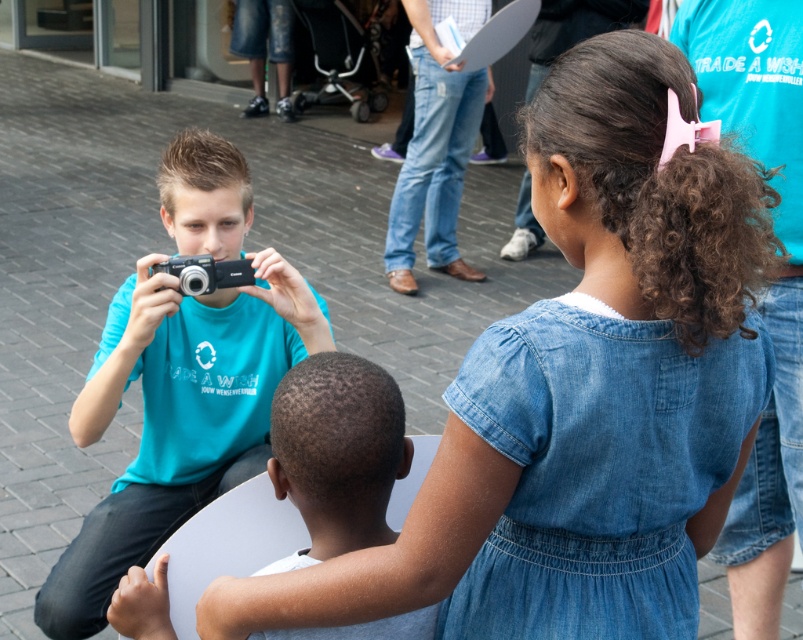
You are a photographer trying to capture a candid shot of the denim dress at center and the matte black camera at center. Since you want to ensure both subjects are in focus, which one should you focus on first considering their positions?

The denim dress at center is in front of the matte black camera at center, so you should focus on the denim dress at center first to ensure both are in focus.

Please describe the position of the denim dress at center in terms of coordinates within the image frame. Use the provided coordinates to answer.

The denim dress at center is located at coordinates point (581, 392).